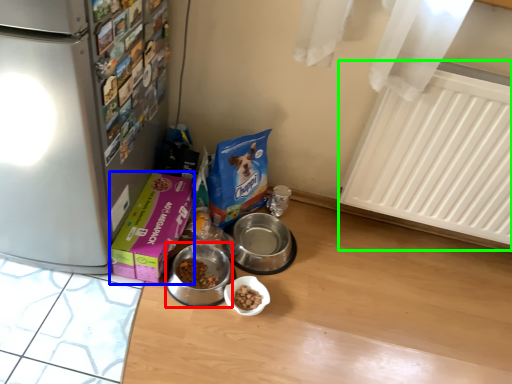
Question: Estimate the real-world distances between objects in this image. Which object is farther from appliance (highlighted by a red box), box (highlighted by a blue box) or radiator (highlighted by a green box)?

Choices:
 (A) box
 (B) radiator

Answer: (B)